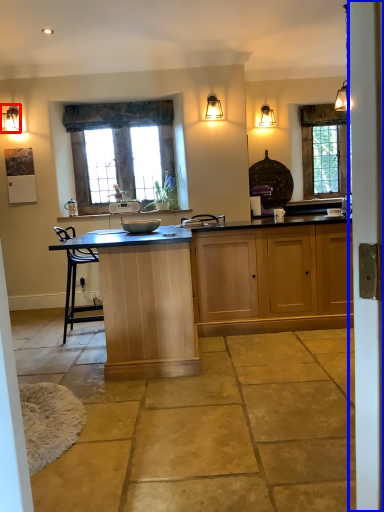
Question: Which of the following is the farthest to the observer, lamp (highlighted by a red box) or screen door (highlighted by a blue box)?

Choices:
 (A) lamp
 (B) screen door

Answer: (A)